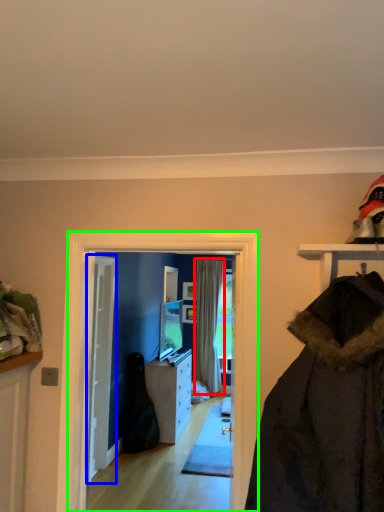
Question: Which object is positioned closest to curtain (highlighted by a red box)? Select from door (highlighted by a blue box) and screen door (highlighted by a green box).

Choices:
 (A) door
 (B) screen door

Answer: (A)